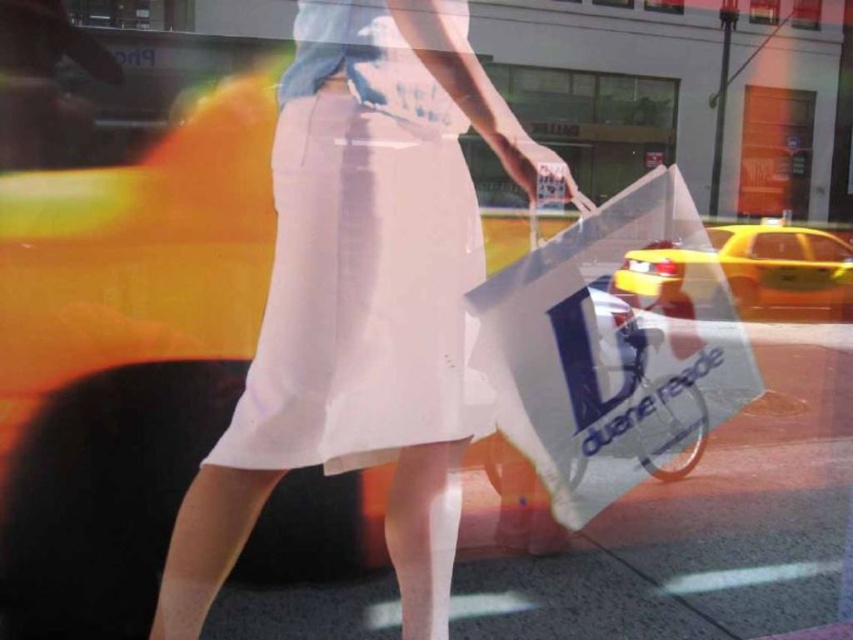
Can you confirm if white smooth pavement at center is thinner than yellow matte taxi at right?

In fact, white smooth pavement at center might be wider than yellow matte taxi at right.

Consider the image. Who is higher up, white smooth pavement at center or yellow matte taxi at right?

yellow matte taxi at right is higher up.

Between point (370, 627) and point (728, 252), which one is positioned in front?

Point (370, 627)

This screenshot has height=640, width=853. What are the coordinates of `white smooth pavement at center` in the screenshot? It's located at (698, 525).

Who is higher up, matte white skirt at center or yellow matte taxi at right?

yellow matte taxi at right

Does matte white skirt at center appear under yellow matte taxi at right?

Indeed, matte white skirt at center is positioned under yellow matte taxi at right.

Does point (352, 301) come farther from viewer compared to point (659, 307)?

No, (352, 301) is in front of (659, 307).

This screenshot has height=640, width=853. I want to click on matte white skirt at center, so click(363, 296).

Between matte white skirt at center and white smooth pavement at center, which one has less height?

white smooth pavement at center is shorter.

Does matte white skirt at center appear on the left side of white smooth pavement at center?

Indeed, matte white skirt at center is positioned on the left side of white smooth pavement at center.

The width and height of the screenshot is (853, 640). Describe the element at coordinates (363, 296) in the screenshot. I see `matte white skirt at center` at that location.

I want to click on matte white skirt at center, so click(x=363, y=296).